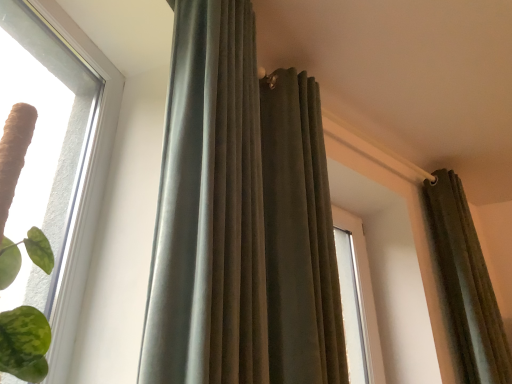
Question: Is clear glass window at upper left turned away from velvet olive curtain at upper right, which appears as the 1th curtain when viewed from the right?

Choices:
 (A) yes
 (B) no

Answer: (B)

Question: Can you confirm if clear glass window at upper left is positioned to the left of velvet olive curtain at upper right, which appears as the 1th curtain when viewed from the right?

Choices:
 (A) no
 (B) yes

Answer: (B)

Question: From the image's perspective, is clear glass window at upper left below velvet olive curtain at upper right, which is the 3th curtain in left-to-right order?

Choices:
 (A) no
 (B) yes

Answer: (A)

Question: Considering the relative positions of clear glass window at upper left and velvet olive curtain at upper right, which appears as the 1th curtain when viewed from the right, in the image provided, is clear glass window at upper left to the right of velvet olive curtain at upper right, which appears as the 1th curtain when viewed from the right, from the viewer's perspective?

Choices:
 (A) no
 (B) yes

Answer: (A)

Question: Does clear glass window at upper left have a smaller size compared to velvet olive curtain at upper right, which appears as the 1th curtain when viewed from the right?

Choices:
 (A) no
 (B) yes

Answer: (B)

Question: From a real-world perspective, is velvet olive curtain at upper center, positioned as the 2th curtain in left-to-right order, above or below clear glass window at upper left?

Choices:
 (A) above
 (B) below

Answer: (A)

Question: In terms of width, does velvet olive curtain at upper center, arranged as the 2th curtain when viewed from the right, look wider or thinner when compared to clear glass window at upper left?

Choices:
 (A) thin
 (B) wide

Answer: (A)

Question: Does point (275, 314) appear closer or farther from the camera than point (42, 291)?

Choices:
 (A) farther
 (B) closer

Answer: (A)

Question: From the image's perspective, is velvet olive curtain at upper center, arranged as the 2th curtain when viewed from the right, positioned above or below clear glass window at upper left?

Choices:
 (A) below
 (B) above

Answer: (B)

Question: From a real-world perspective, is velvet olive curtain at upper right, which appears as the 1th curtain when viewed from the right, above or below clear glass window at upper left?

Choices:
 (A) above
 (B) below

Answer: (A)

Question: From the image's perspective, is velvet olive curtain at upper right, which appears as the 1th curtain when viewed from the right, located above or below clear glass window at upper left?

Choices:
 (A) below
 (B) above

Answer: (A)

Question: Is point (508, 375) positioned closer to the camera than point (67, 120)?

Choices:
 (A) farther
 (B) closer

Answer: (A)

Question: Looking at the image, does velvet olive curtain at upper right, which is the 3th curtain in left-to-right order, seem bigger or smaller compared to clear glass window at upper left?

Choices:
 (A) small
 (B) big

Answer: (B)

Question: In terms of width, does clear glass window at upper left look wider or thinner when compared to velvet olive curtain at upper right, which is the 3th curtain in left-to-right order?

Choices:
 (A) wide
 (B) thin

Answer: (A)

Question: From a real-world perspective, is clear glass window at upper left physically located above or below velvet olive curtain at upper right, which is the 3th curtain in left-to-right order?

Choices:
 (A) above
 (B) below

Answer: (B)